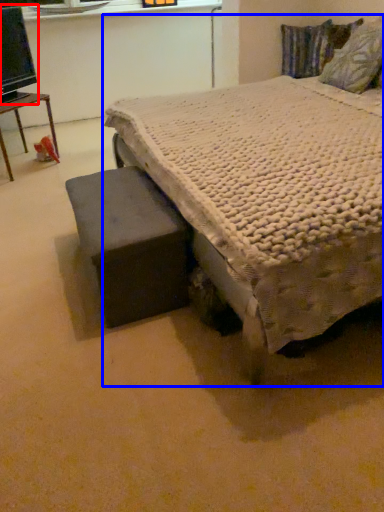
Question: Which point is further to the camera, computer monitor (highlighted by a red box) or bed (highlighted by a blue box)?

Choices:
 (A) computer monitor
 (B) bed

Answer: (A)